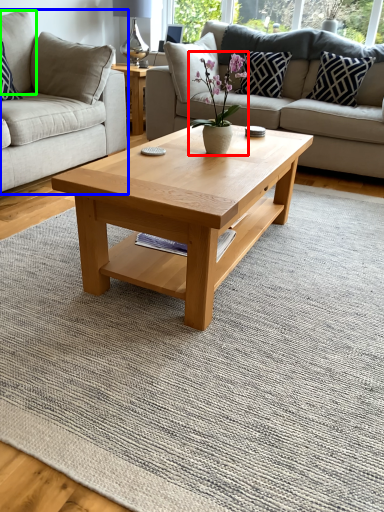
Question: Which object is the farthest from houseplant (highlighted by a red box)? Choose among these: studio couch (highlighted by a blue box) or pillow (highlighted by a green box).

Choices:
 (A) studio couch
 (B) pillow

Answer: (B)